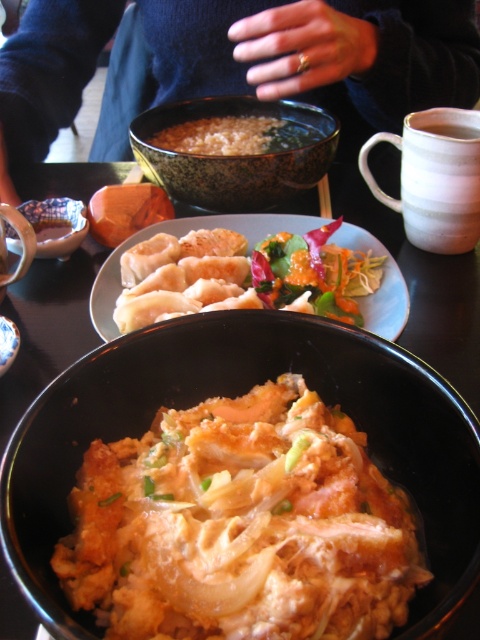
In the scene shown: You are a server who needs to place a 6.25 inch wide plate between the shiny brown bowl at center and the shiny orange salad at center on the table. Can you fit it there?

The distance between the shiny brown bowl at center and the shiny orange salad at center is 6.50 inches. Since the plate is 6.25 inches wide, it can fit between them as the space is slightly larger than the plate.

You are a diner who wants to reach for the brown matte rice at center and the porcelain bowl at lower left. Based on their positions, which one is closer to your right hand?

The brown matte rice at center is to the right of porcelain bowl at lower left, so the brown matte rice at center is closer to your right hand.

You are a food critic evaluating the presentation of this meal. You notice the brown matte rice at center and the porcelain bowl at lower left. Which of these two items has a larger diameter?

The brown matte rice at center might be wider than porcelain bowl at lower left, so it likely has a larger diameter.